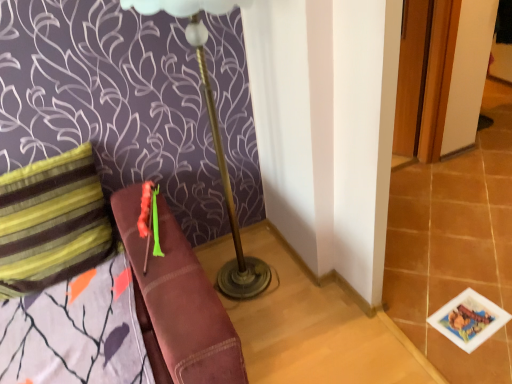
Question: Is striped fabric pillow at left at the right side of metallic gold table lamp at center?

Choices:
 (A) no
 (B) yes

Answer: (A)

Question: Is metallic gold table lamp at center completely or partially inside striped fabric pillow at left?

Choices:
 (A) yes
 (B) no

Answer: (B)

Question: Does striped fabric pillow at left have a larger size compared to metallic gold table lamp at center?

Choices:
 (A) yes
 (B) no

Answer: (B)

Question: Considering the relative sizes of striped fabric pillow at left and metallic gold table lamp at center in the image provided, is striped fabric pillow at left shorter than metallic gold table lamp at center?

Choices:
 (A) no
 (B) yes

Answer: (B)

Question: Is striped fabric pillow at left facing away from metallic gold table lamp at center?

Choices:
 (A) no
 (B) yes

Answer: (A)

Question: From a real-world perspective, is printed paper card at lower right physically located above or below striped fabric pillow at left?

Choices:
 (A) below
 (B) above

Answer: (A)

Question: Is point (472, 317) positioned closer to the camera than point (47, 175)?

Choices:
 (A) closer
 (B) farther

Answer: (B)

Question: Based on their sizes in the image, would you say printed paper card at lower right is bigger or smaller than striped fabric pillow at left?

Choices:
 (A) big
 (B) small

Answer: (B)

Question: From their relative heights in the image, would you say printed paper card at lower right is taller or shorter than striped fabric pillow at left?

Choices:
 (A) short
 (B) tall

Answer: (A)

Question: Considering the positions of printed paper card at lower right and metallic gold table lamp at center in the image, is printed paper card at lower right bigger or smaller than metallic gold table lamp at center?

Choices:
 (A) small
 (B) big

Answer: (A)

Question: Considering the positions of printed paper card at lower right and metallic gold table lamp at center in the image, is printed paper card at lower right wider or thinner than metallic gold table lamp at center?

Choices:
 (A) wide
 (B) thin

Answer: (B)

Question: Considering the positions of printed paper card at lower right and metallic gold table lamp at center in the image, is printed paper card at lower right taller or shorter than metallic gold table lamp at center?

Choices:
 (A) tall
 (B) short

Answer: (B)

Question: Relative to metallic gold table lamp at center, is printed paper card at lower right in front or behind?

Choices:
 (A) behind
 (B) front

Answer: (A)

Question: Based on their positions, is striped fabric pillow at left located to the left or right of printed paper card at lower right?

Choices:
 (A) right
 (B) left

Answer: (B)

Question: Considering the positions of point (60, 203) and point (445, 309), is point (60, 203) closer or farther from the camera than point (445, 309)?

Choices:
 (A) farther
 (B) closer

Answer: (B)